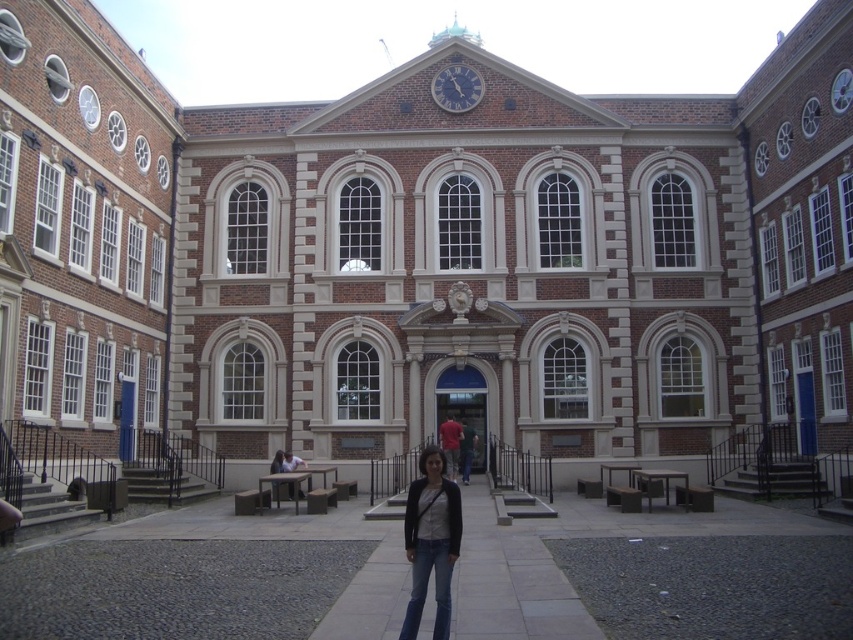
Question: Among these objects, which one is farthest from the camera?

Choices:
 (A) denim jeans at center
 (B) dark red shirt at center

Answer: (B)

Question: Which point appears closest to the camera in this image?

Choices:
 (A) (471, 76)
 (B) (288, 460)
 (C) (463, 451)

Answer: (B)

Question: Is dark red shirt at center above light brown wooden bench at center?

Choices:
 (A) yes
 (B) no

Answer: (A)

Question: Which object appears closest to the camera in this image?

Choices:
 (A) blue painted metal clock at upper center
 (B) denim jeans at center
 (C) light brown wooden bench at center

Answer: (B)

Question: Is dark red shirt at center in front of light brown wooden bench at center?

Choices:
 (A) no
 (B) yes

Answer: (A)

Question: Is dark red shirt at center further to the viewer compared to light brown wooden bench at center?

Choices:
 (A) yes
 (B) no

Answer: (A)